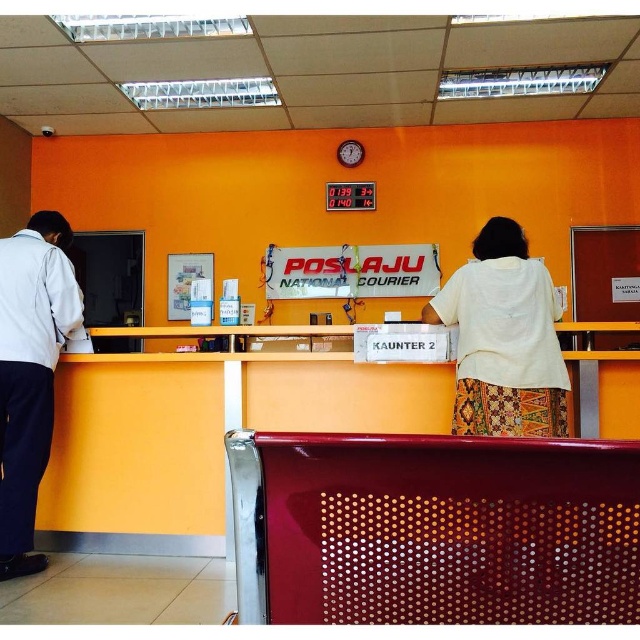
Is yellow matte desk at left smaller than white shirt at left?

No.

Who is positioned more to the right, yellow matte desk at left or white shirt at left?

From the viewer's perspective, yellow matte desk at left appears more on the right side.

Who is more forward, (122, 369) or (20, 540)?

Point (20, 540)

Identify the location of yellow matte desk at left. (200, 435).

Does white fabric at center come behind white shirt at left?

No.

Which is in front, point (547, 371) or point (22, 244)?

Point (547, 371)

Image resolution: width=640 pixels, height=640 pixels. I want to click on white fabric at center, so click(x=502, y=339).

Who is taller, yellow matte desk at left or white fabric at center?

Standing taller between the two is yellow matte desk at left.

Between yellow matte desk at left and white fabric at center, which one is positioned lower?

Positioned lower is yellow matte desk at left.

Where is `yellow matte desk at left`? The image size is (640, 640). yellow matte desk at left is located at coordinates (200, 435).